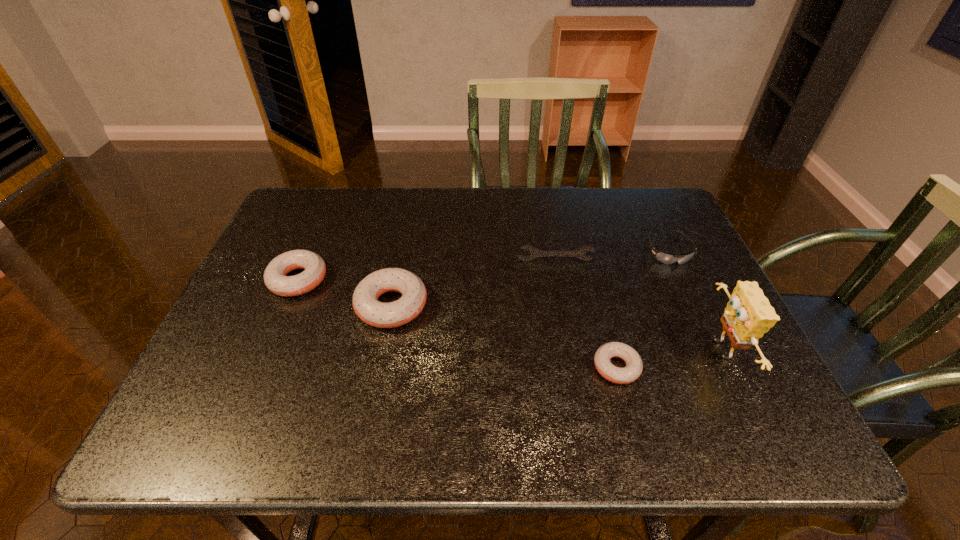
Please point a spot to place another doughnut for symmetrical spacing. Please provide its 2D coordinates. Your answer should be formatted as a tuple, i.e. [(x, y)], where the tuple contains the x and y coordinates of a point satisfying the conditions above.

[(497, 334)]